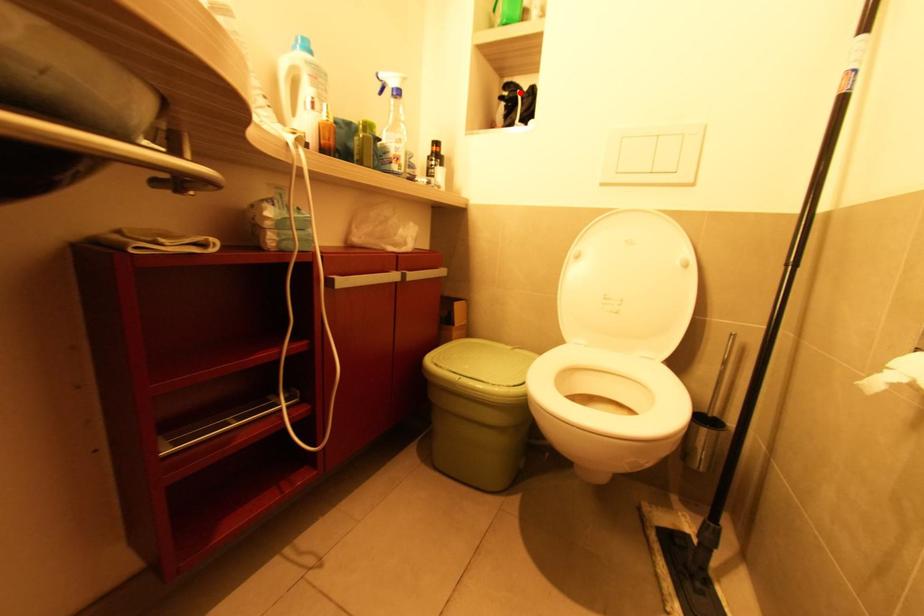
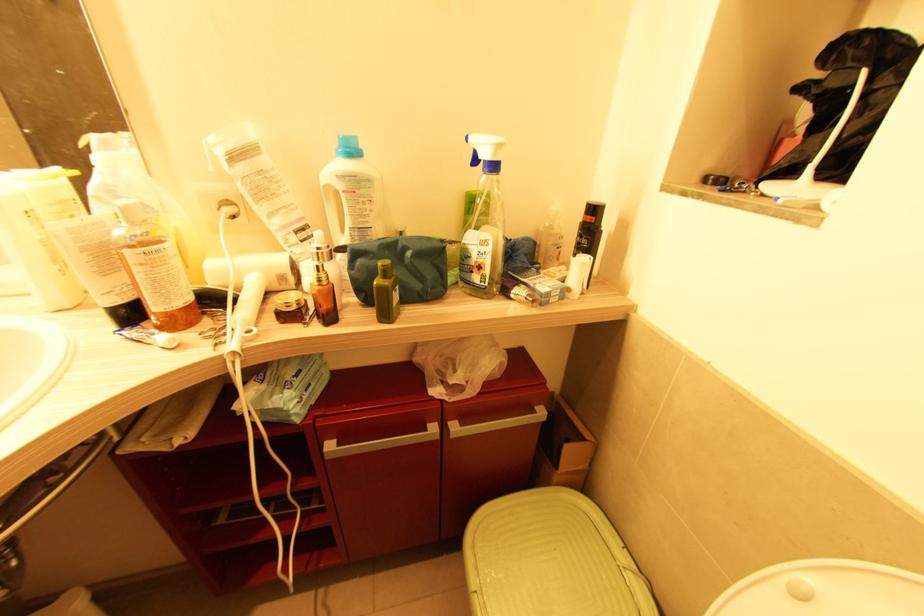
Find the pixel in the second image that matches the highlighted location in the first image.

(867, 73)